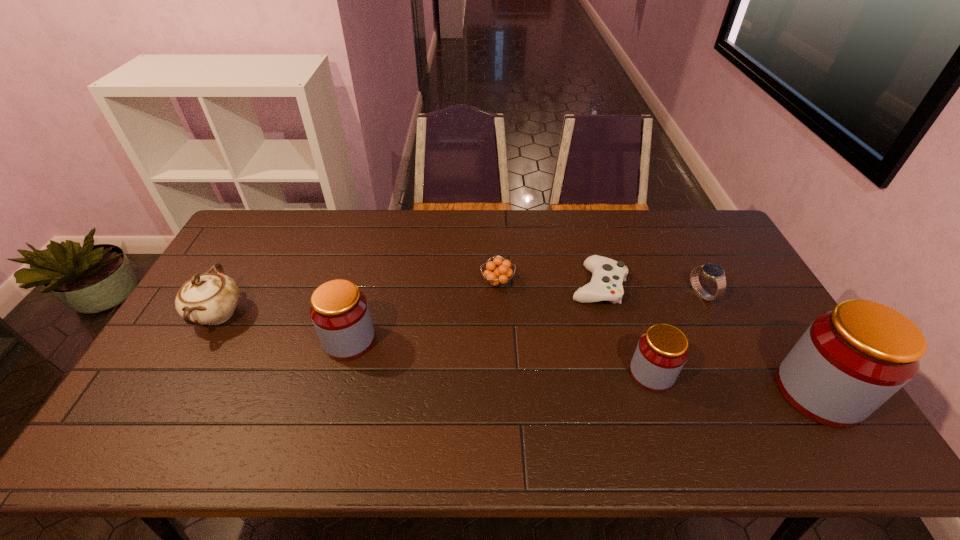
Find the location of a particular element. This screenshot has width=960, height=540. unoccupied position between the rightmost object and the shortest jar is located at coordinates (735, 383).

Locate an element on the screen. The height and width of the screenshot is (540, 960). free point between the rightmost jar and the second jar from left to right is located at coordinates (735, 383).

Identify the location of vacant space that is in between the control and the watch. (650, 290).

The width and height of the screenshot is (960, 540). I want to click on free area in between the leftmost jar and the control, so click(x=473, y=313).

Find the location of `vacant space that is in between the shortest jar and the rightmost object`. vacant space that is in between the shortest jar and the rightmost object is located at coordinates (735, 383).

At what (x,y) coordinates should I click in order to perform the action: click on object that stands as the fifth closest to the control. Please return your answer as a coordinate pair (x, y). Looking at the image, I should click on (339, 311).

Image resolution: width=960 pixels, height=540 pixels. I want to click on the sixth closest object to the second shortest jar, so click(852, 359).

Select which jar appears as the third closest to the leftmost object. Please provide its 2D coordinates. Your answer should be formatted as a tuple, i.e. [(x, y)], where the tuple contains the x and y coordinates of a point satisfying the conditions above.

[(852, 359)]

Point out which jar is positioned as the nearest to the second jar from left to right. Please provide its 2D coordinates. Your answer should be formatted as a tuple, i.e. [(x, y)], where the tuple contains the x and y coordinates of a point satisfying the conditions above.

[(852, 359)]

Locate an element on the screen. free spot that satisfies the following two spatial constraints: 1. on the back side of the second jar from right to left; 2. on the right side of the sixth object from left to right is located at coordinates (626, 294).